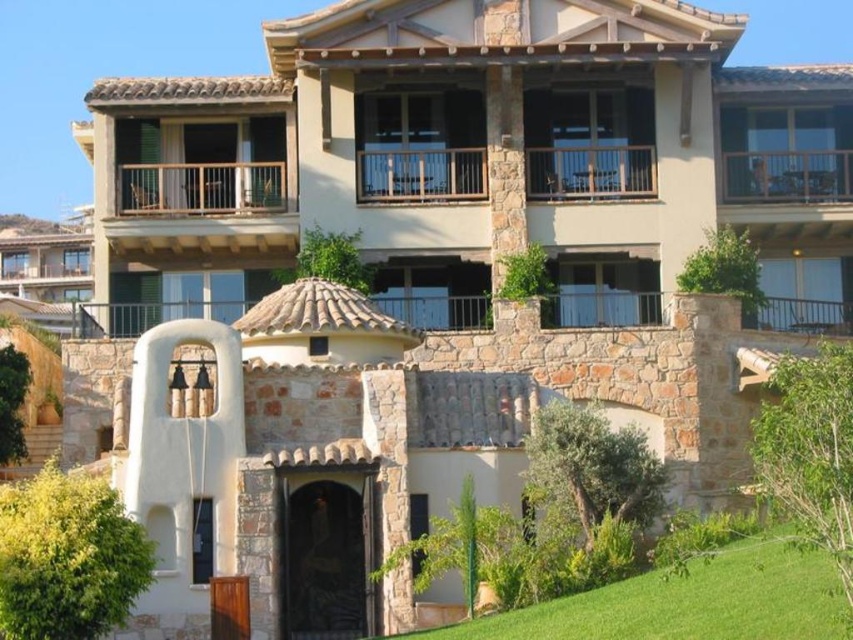
You are standing at the center of the image and want to walk to the green grass at lower right. Which direction should you move in to reach it?

Since the green grass at lower right is located at point 0.928 on the x and 0.800 on the y, you should move towards the right and downward to reach it.

You are a painter standing at the base of the building and need to decide whether to use a ladder to reach the brown wooden railing at upper center. Considering the height of the green grass at lower right, can you estimate if the railing is within your ladder height?

The green grass at lower right is taller than the brown wooden railing at upper center. Since the grass is taller, the railing is shorter than the grass. If the ladder can reach the height of the grass, then it can also reach the railing.